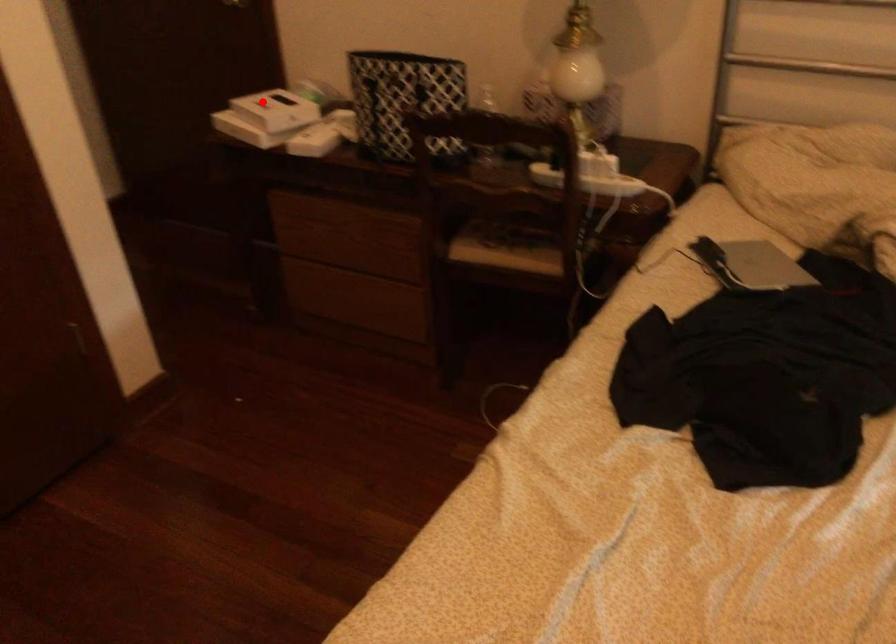
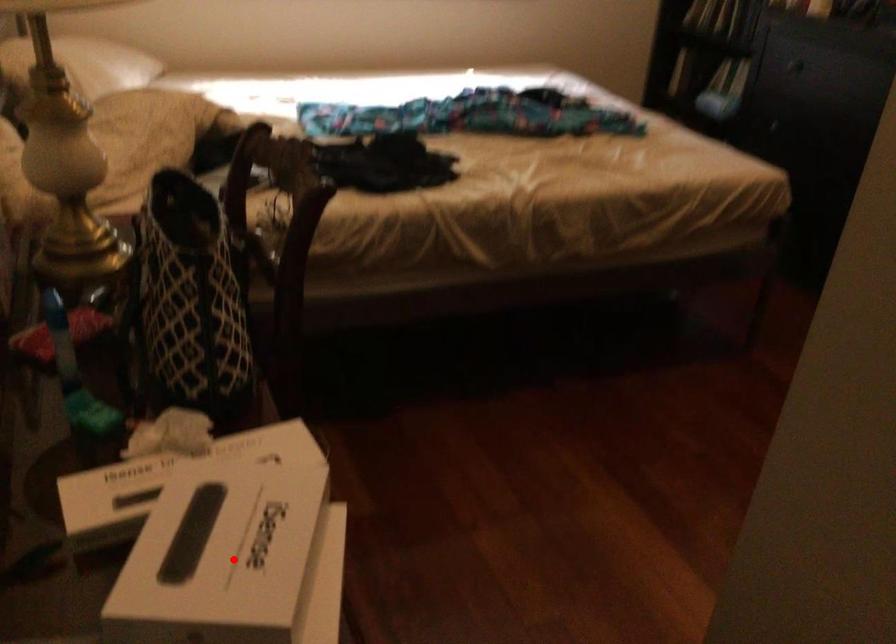
I am providing you with two images of the same scene from different viewpoints. A red point is marked on the first image and another point is marked on the second image. Are the points marked in image1 and image2 representing the same 3D position?

Yes